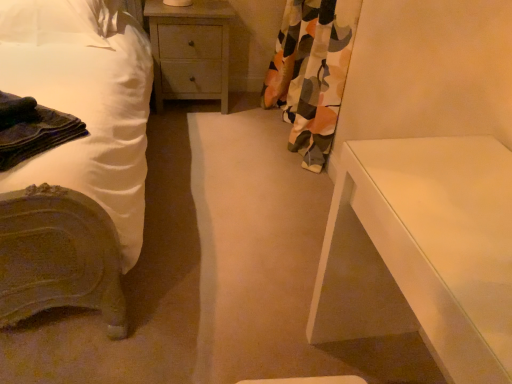
Question: Considering the positions of point (203, 38) and point (330, 16), is point (203, 38) closer or farther from the camera than point (330, 16)?

Choices:
 (A) farther
 (B) closer

Answer: (A)

Question: From the image's perspective, is wooden nightstand at center above or below floral fabric curtain at right?

Choices:
 (A) below
 (B) above

Answer: (B)

Question: Based on their relative distances, which object is farther from the white fabric pillow at upper left?

Choices:
 (A) dark blue fabric at left
 (B) floral fabric curtain at right
 (C) wooden nightstand at center
 (D) white smooth table at right
 (E) white matte bed at left

Answer: (D)

Question: Which of these objects is positioned closest to the floral fabric curtain at right?

Choices:
 (A) white fabric pillow at upper left
 (B) wooden nightstand at center
 (C) white smooth table at right
 (D) dark blue fabric at left
 (E) white matte bed at left

Answer: (B)